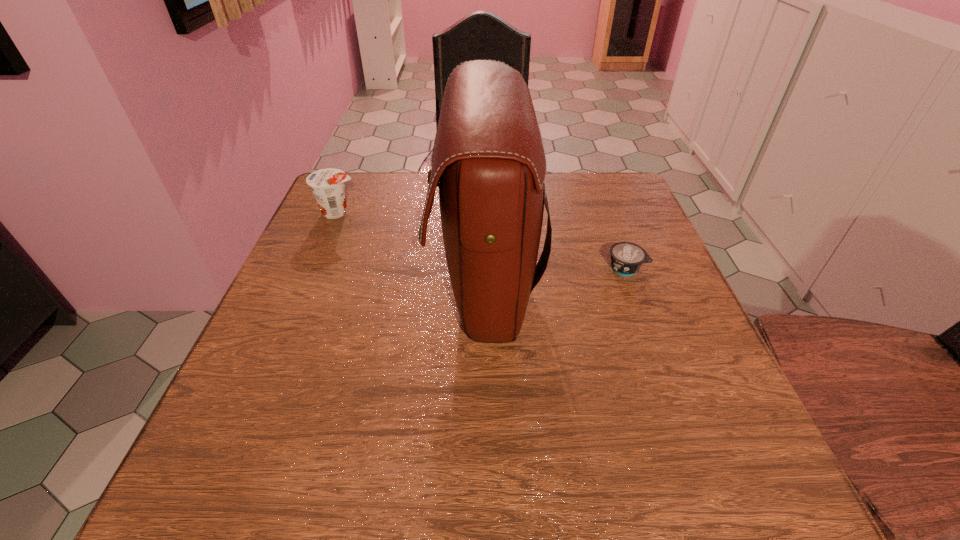
At what (x,y) coordinates should I click in order to perform the action: click on free location at the near left corner. Please return your answer as a coordinate pair (x, y). Image resolution: width=960 pixels, height=540 pixels. Looking at the image, I should click on (218, 466).

I want to click on vacant space at the far right corner, so click(x=632, y=194).

The width and height of the screenshot is (960, 540). What are the coordinates of `free space at the near right corner of the desktop` in the screenshot? It's located at (712, 476).

Find the location of `vacant region between the shorter yogurt and the tallest object`. vacant region between the shorter yogurt and the tallest object is located at coordinates (555, 276).

Find the location of a particular element. This screenshot has height=540, width=960. free area in between the second object from right to left and the shortest object is located at coordinates (555, 276).

Image resolution: width=960 pixels, height=540 pixels. In order to click on free space that is in between the tallest object and the nearer yogurt in this screenshot , I will do `click(555, 276)`.

Locate an element on the screen. vacant space in between the shorter yogurt and the satchel is located at coordinates (555, 276).

Locate an element on the screen. free space that is in between the second object from right to left and the taller yogurt is located at coordinates pos(411,248).

At what (x,y) coordinates should I click in order to perform the action: click on vacant space that is in between the satchel and the second shortest object. Please return your answer as a coordinate pair (x, y). The height and width of the screenshot is (540, 960). Looking at the image, I should click on tap(411, 248).

Find the location of `free area in between the second object from left to right and the shortest object`. free area in between the second object from left to right and the shortest object is located at coordinates (555, 276).